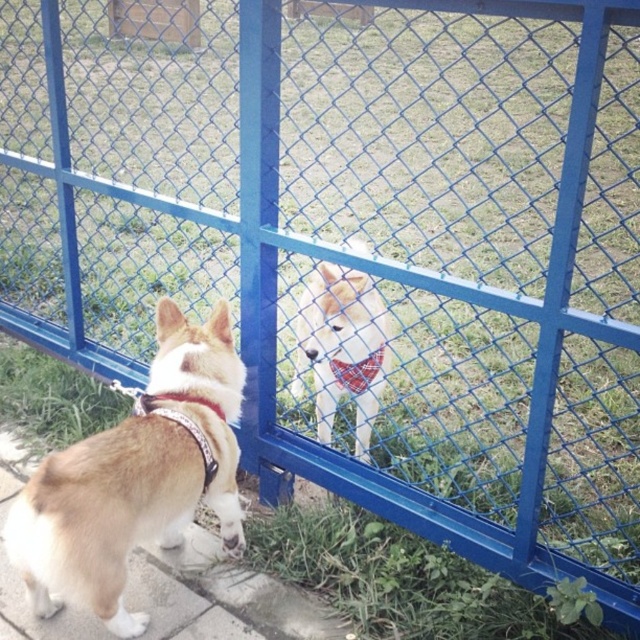
Question: Which of the following is the farthest from the observer?

Choices:
 (A) brown fur dog at left
 (B) plaid fabric neckband at center
 (C) white fur dog at center

Answer: (B)

Question: Is brown fur dog at left closer to the viewer compared to plaid fabric neckband at center?

Choices:
 (A) yes
 (B) no

Answer: (A)

Question: Which of the following is the closest to the observer?

Choices:
 (A) (356, 342)
 (B) (333, 369)
 (C) (116, 540)

Answer: (C)

Question: Observing the image, what is the correct spatial positioning of brown fur dog at left in reference to plaid fabric neckband at center?

Choices:
 (A) left
 (B) right

Answer: (A)

Question: Which of the following is the farthest from the observer?

Choices:
 (A) click(358, 320)
 (B) click(93, 442)
 (C) click(358, 365)

Answer: (C)

Question: Considering the relative positions of brown fur dog at left and plaid fabric neckband at center in the image provided, where is brown fur dog at left located with respect to plaid fabric neckband at center?

Choices:
 (A) above
 (B) below

Answer: (B)